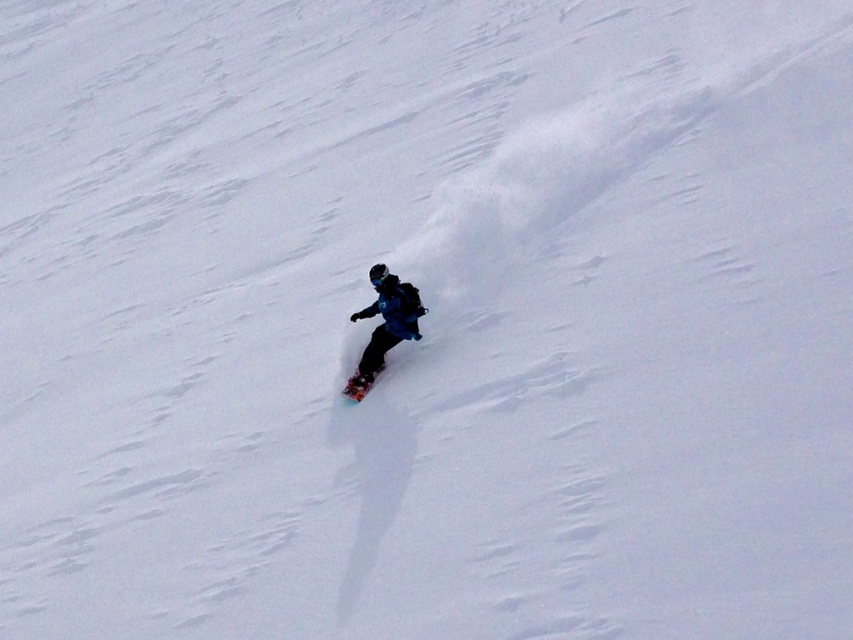
You are standing at the base of the slope and want to reach the point marked at coordinates point (373, 307). If your snowboard can travel 100 feet on a single charge, will you have enough battery to make it to the point without recharging?

The distance of point (373, 307) from viewer is 59.54 feet, so yes, the snowboard can reach the point as it is within the 100 feet range of a single charge.

You are a photographer trying to capture the snowboarder from the best angle. You notice two points marked in the scene. Which point, point (x=358, y=376) or point (x=370, y=378), is closer to you?

Point (x=358, y=376) is closer to the viewer than point (x=370, y=378).